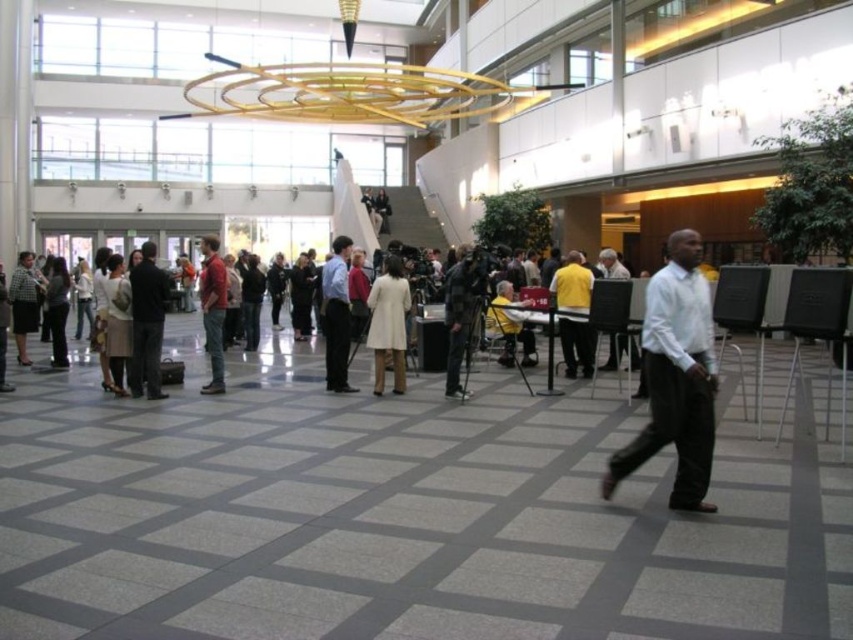
Question: Which point appears closest to the camera in this image?

Choices:
 (A) (480, 275)
 (B) (508, 364)

Answer: (A)

Question: Does light beige coat at center have a lesser width compared to plaid fabric jacket at left?

Choices:
 (A) no
 (B) yes

Answer: (A)

Question: Estimate the real-world distances between objects in this image. Which object is closer to the matte black camera at center?

Choices:
 (A) light beige coat at center
 (B) white shirt at center

Answer: (A)

Question: Is matte black camera at center bigger than yellow shirt at center?

Choices:
 (A) yes
 (B) no

Answer: (B)

Question: Which point is closer to the camera?

Choices:
 (A) matte black camera at center
 (B) plaid fabric jacket at left
 (C) light beige coat at center

Answer: (A)

Question: Does white shirt at center lie in front of dark gray pants at center?

Choices:
 (A) yes
 (B) no

Answer: (A)